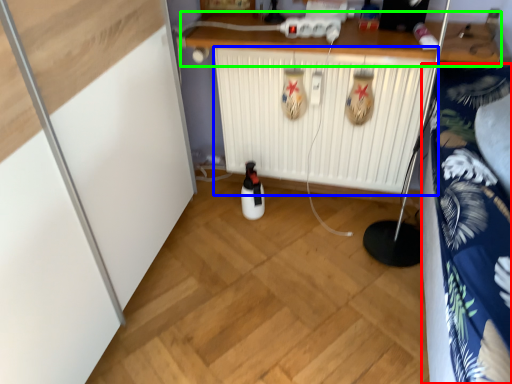
Question: Which object is the closest to the bedding (highlighted by a red box)? Choose among these: radiator (highlighted by a blue box) or counter (highlighted by a green box).

Choices:
 (A) radiator
 (B) counter

Answer: (B)